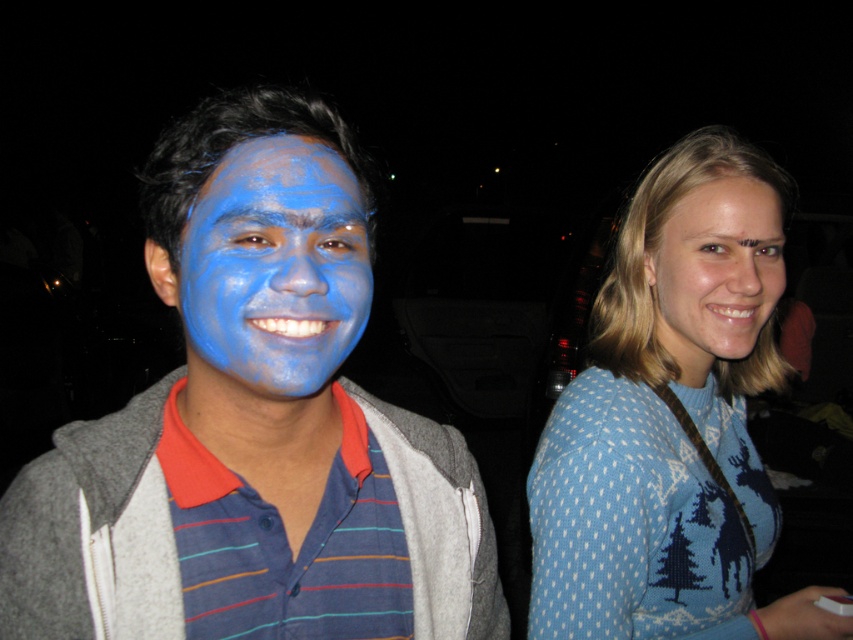
Question: Does matte blue face paint at center appear on the right side of blue matte face at right?

Choices:
 (A) no
 (B) yes

Answer: (A)

Question: Which point appears farthest from the camera in this image?

Choices:
 (A) (750, 228)
 (B) (755, 292)

Answer: (A)

Question: Which object appears farthest from the camera in this image?

Choices:
 (A) blue matte face at right
 (B) matte blue face paint at center
 (C) blue knitted sweater at upper right

Answer: (A)

Question: Among these points, which one is nearest to the camera?

Choices:
 (A) (679, 291)
 (B) (345, 410)
 (C) (312, 316)
 (D) (695, 148)

Answer: (C)

Question: Is blue knitted sweater at upper right to the right of blue matte face at left from the viewer's perspective?

Choices:
 (A) yes
 (B) no

Answer: (A)

Question: Is matte blue face paint at center positioned before blue knitted sweater at upper right?

Choices:
 (A) no
 (B) yes

Answer: (B)